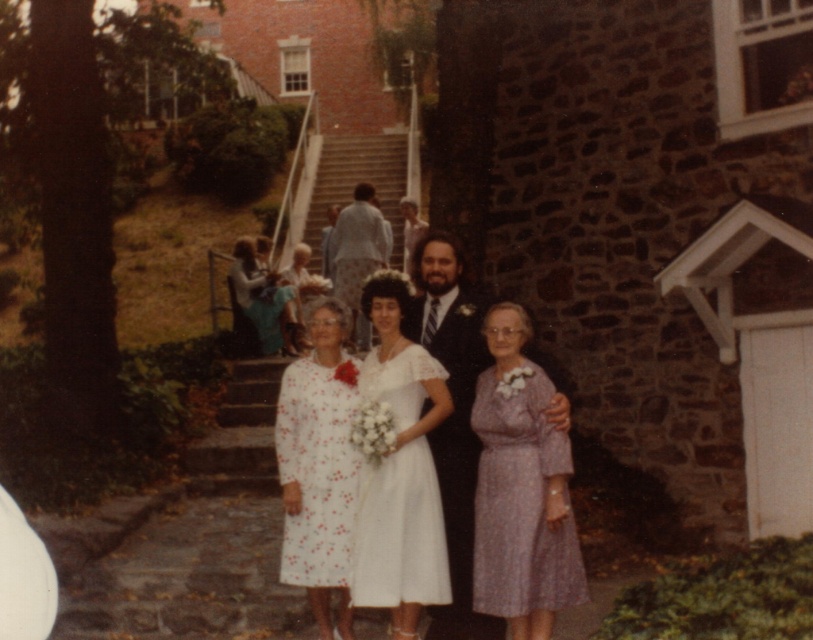
You are a photographer trying to adjust the spacing between the white lace dress at center and the black satin suit at center for a better composition. The current distance between them is 36.08 centimeters. If you want to reduce the distance by 25 percent, what should be the new distance in centimeters?

To reduce the distance between the white lace dress at center and the black satin suit at center by 25 percent, subtract 25 percent of 36.08 cm from the original distance. 25 percent of 36.08 cm is 9.02 cm. Subtracting this from 36.08 cm gives a new distance of 27.06 centimeters.

In the scene shown: You are a photographer trying to adjust the lighting for the wedding photo. You notice two garments at the center of the image, the black satin suit at center and the light blue fabric shirt at center. Which garment is positioned lower in the frame?

The black satin suit at center is below the light blue fabric shirt at center, so the black satin suit at center is positioned lower in the frame.